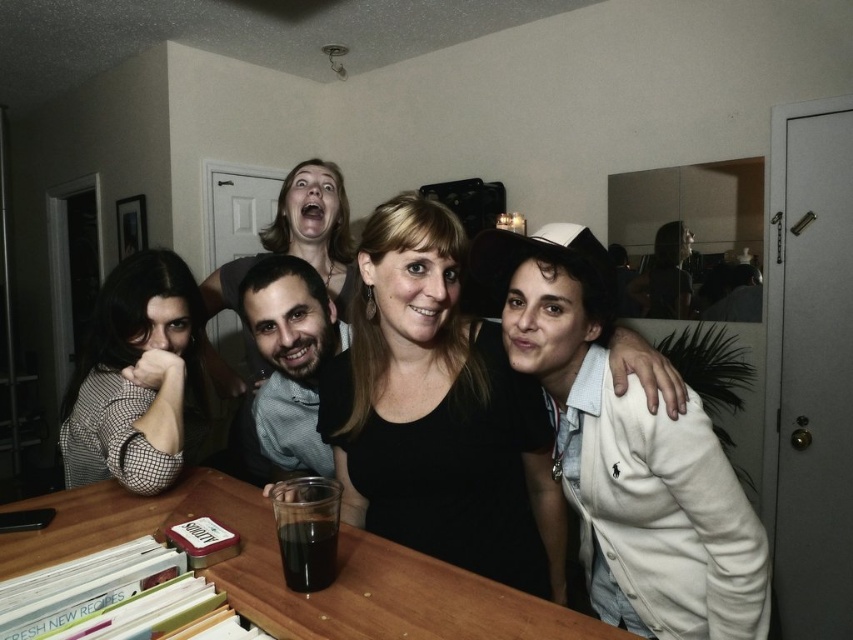
Can you confirm if black checkered shirt at left is wider than light brown shirt at center?

Indeed, black checkered shirt at left has a greater width compared to light brown shirt at center.

Can you confirm if black checkered shirt at left is positioned above light brown shirt at center?

Actually, black checkered shirt at left is below light brown shirt at center.

This screenshot has height=640, width=853. I want to click on black checkered shirt at left, so click(137, 378).

Who is lower down, white cotton jacket at right or matte black hair at upper center?

white cotton jacket at right is lower down.

Is white cotton jacket at right positioned in front of matte black hair at upper center?

Yes.

Where is `white cotton jacket at right`? The image size is (853, 640). white cotton jacket at right is located at coordinates coord(631,460).

Can you confirm if white cotton jacket at right is thinner than dark liquid glass at center?

Incorrect, white cotton jacket at right's width is not less than dark liquid glass at center's.

Is white cotton jacket at right wider than dark liquid glass at center?

Yes, white cotton jacket at right is wider than dark liquid glass at center.

The width and height of the screenshot is (853, 640). I want to click on white cotton jacket at right, so click(631, 460).